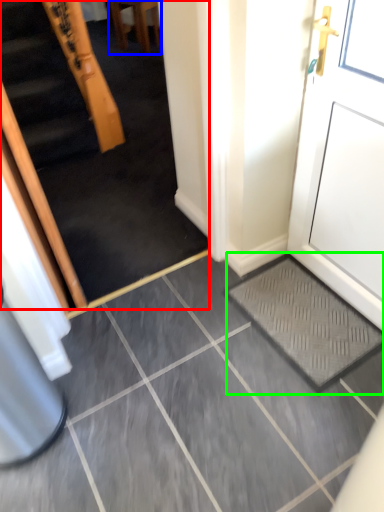
Question: Which object is the farthest from escalator (highlighted by a red box)? Choose among these: furniture (highlighted by a blue box) or doormat (highlighted by a green box).

Choices:
 (A) furniture
 (B) doormat

Answer: (A)